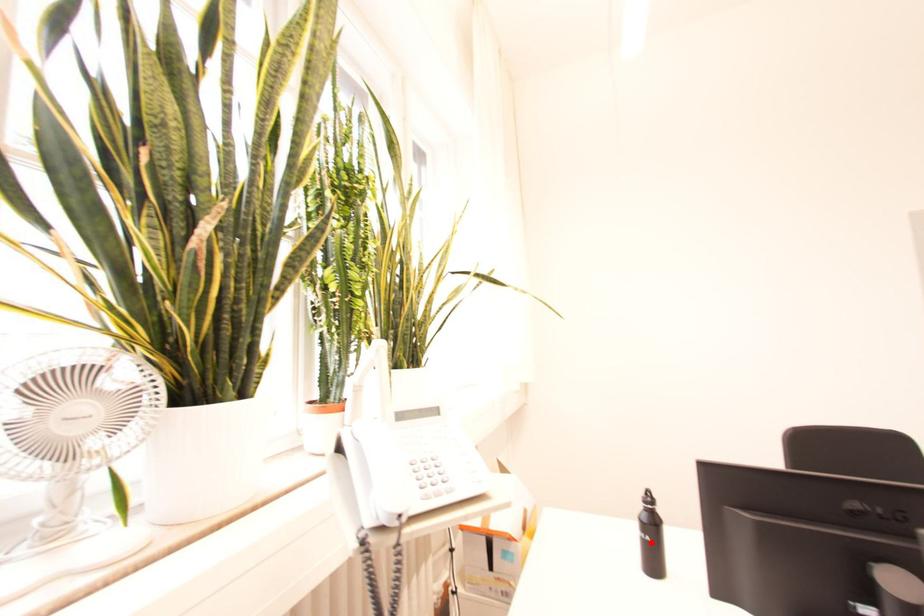
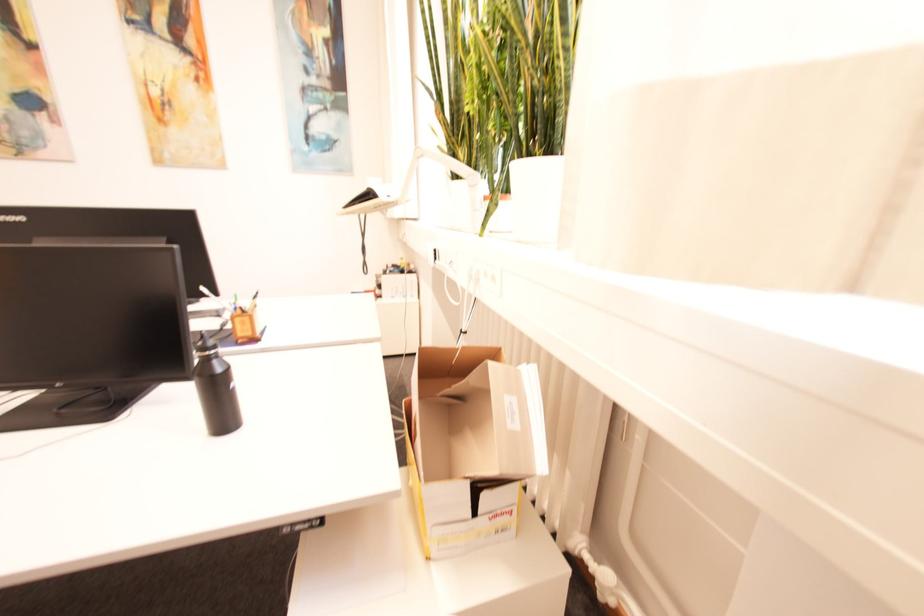
Question: I am providing you with two images of the same scene from different viewpoints. A red point is marked on the first image. Is the red point's position out of view in image 2?

Choices:
 (A) Yes
 (B) No

Answer: (A)